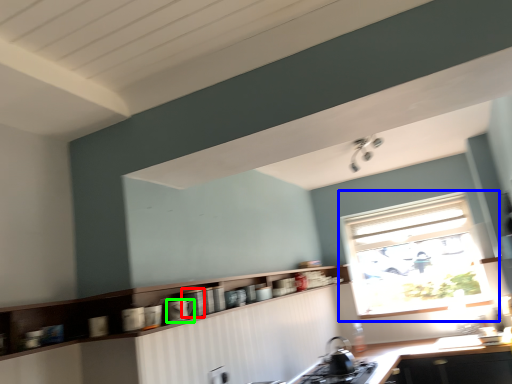
Question: Based on their relative distances, which object is nearer to appliance (highlighted by a red box)? Choose from window (highlighted by a blue box) and appliance (highlighted by a green box).

Choices:
 (A) window
 (B) appliance

Answer: (B)